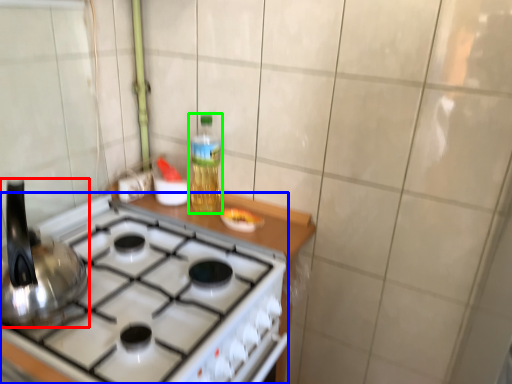
Question: Which is nearer to the kitchen appliance (highlighted by a red box)? gas stove (highlighted by a blue box) or bottle (highlighted by a green box).

Choices:
 (A) gas stove
 (B) bottle

Answer: (A)